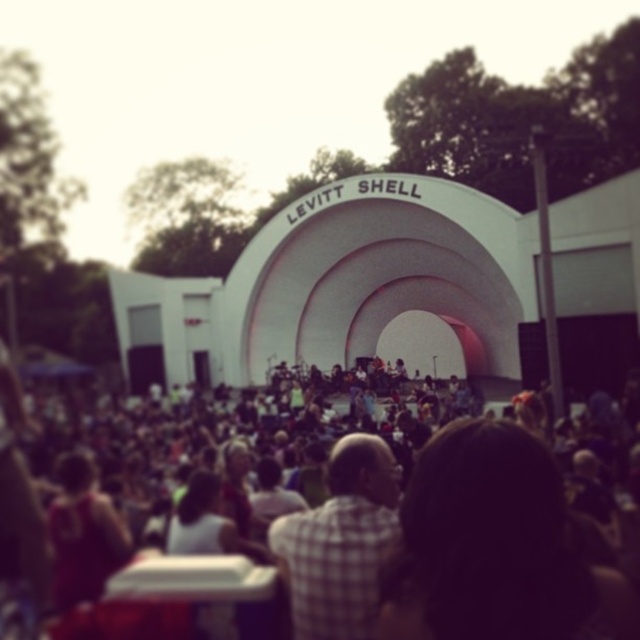
Question: Does checkered fabric crowd at center have a larger size compared to white smooth levitt shell at center?

Choices:
 (A) no
 (B) yes

Answer: (A)

Question: Does white smooth levitt shell at center appear on the left side of checkered fabric shirt at center?

Choices:
 (A) yes
 (B) no

Answer: (A)

Question: Does white smooth levitt shell at center have a lesser width compared to checkered fabric shirt at center?

Choices:
 (A) no
 (B) yes

Answer: (A)

Question: Based on their relative distances, which object is nearer to the checkered fabric shirt at center?

Choices:
 (A) checkered fabric crowd at center
 (B) white smooth levitt shell at center

Answer: (A)

Question: Which point is farther to the camera?

Choices:
 (A) checkered fabric crowd at center
 (B) white smooth levitt shell at center

Answer: (B)

Question: Among these points, which one is farthest from the camera?

Choices:
 (A) (540, 579)
 (B) (365, 253)
 (C) (387, 525)

Answer: (B)